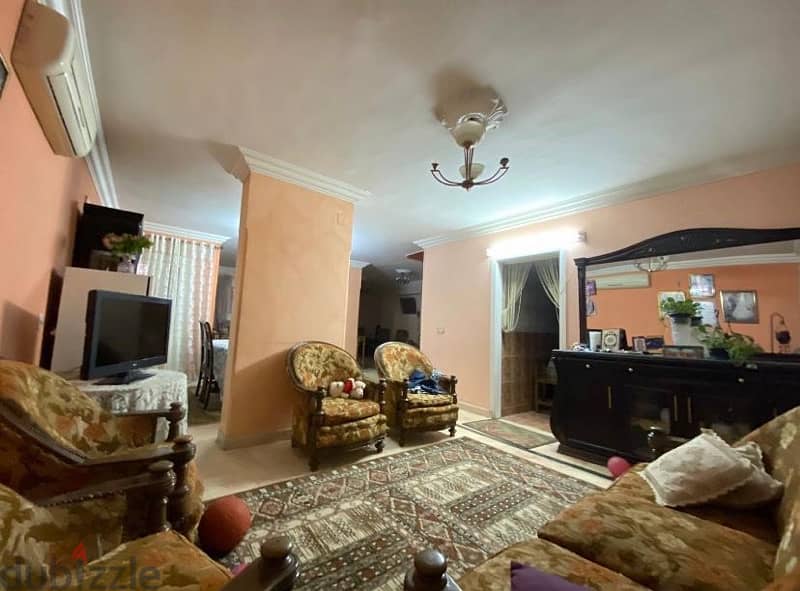
Locate an element on the screen. The height and width of the screenshot is (591, 800). white molding is located at coordinates (96, 174), (202, 235), (230, 269), (288, 180), (369, 266), (437, 237), (498, 298), (756, 263).